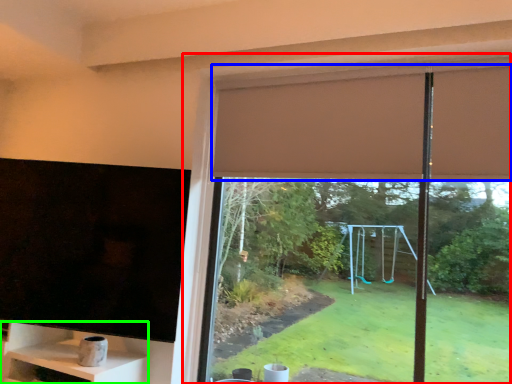
Question: Which is nearer to the window (highlighted by a red box)? curtain (highlighted by a blue box) or shelf (highlighted by a green box).

Choices:
 (A) curtain
 (B) shelf

Answer: (A)